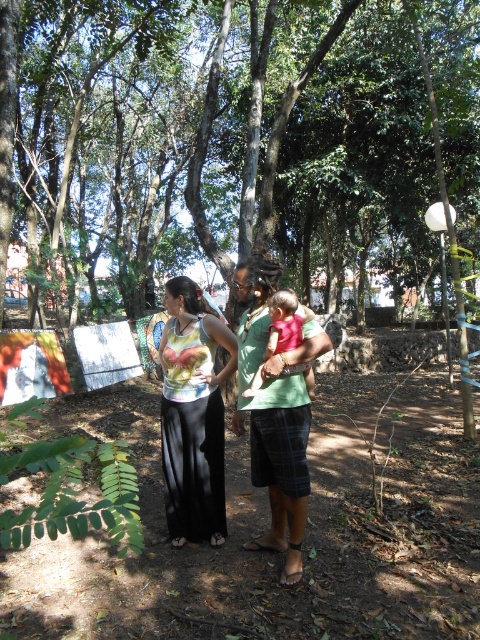
Question: Which of these objects is positioned closest to the printed fabric top at center?

Choices:
 (A) green plaid shorts at center
 (B) pink fabric baby at center

Answer: (A)

Question: Among these points, which one is farthest from the camera?

Choices:
 (A) (282, 330)
 (B) (297, 364)
 (C) (191, 436)

Answer: (C)

Question: Does printed fabric top at center have a lesser width compared to pink fabric baby at center?

Choices:
 (A) no
 (B) yes

Answer: (A)

Question: Which of the following is the farthest from the observer?

Choices:
 (A) pink fabric baby at center
 (B) printed fabric top at center
 (C) green plaid shorts at center

Answer: (B)

Question: Is the position of green plaid shorts at center less distant than that of pink fabric baby at center?

Choices:
 (A) no
 (B) yes

Answer: (B)

Question: Does green plaid shorts at center have a larger size compared to pink fabric baby at center?

Choices:
 (A) yes
 (B) no

Answer: (A)